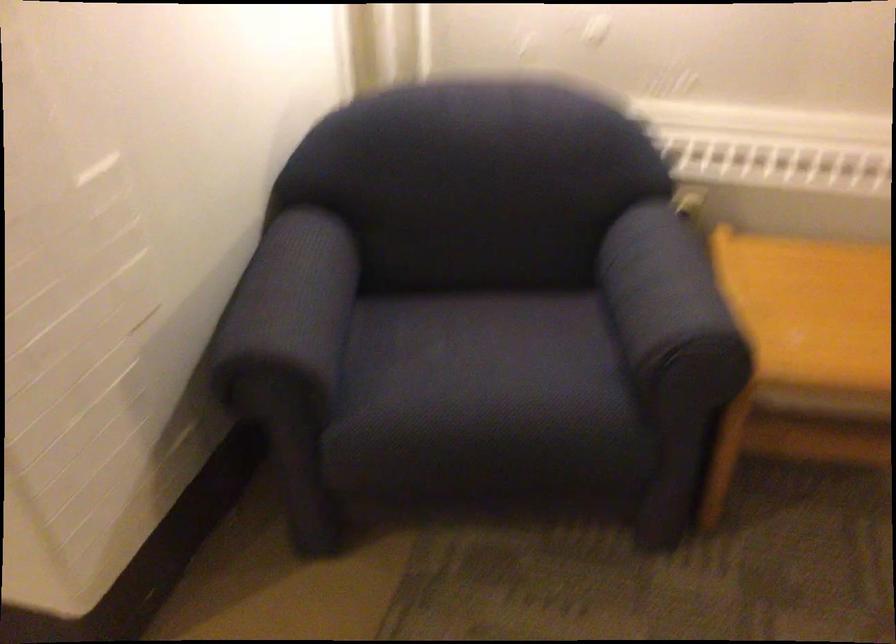
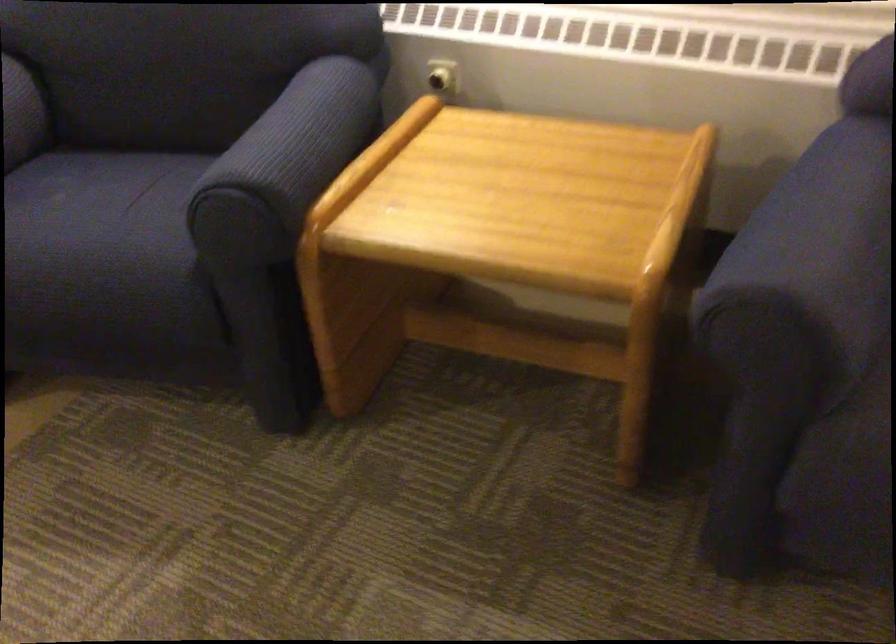
In the second image, find the point that corresponds to point 504,379 in the first image.

(99, 232)